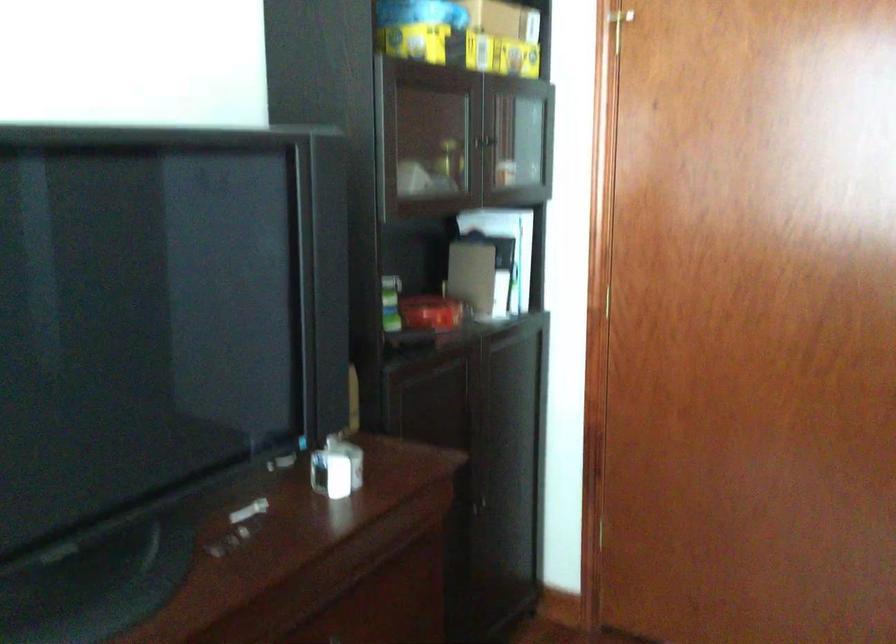
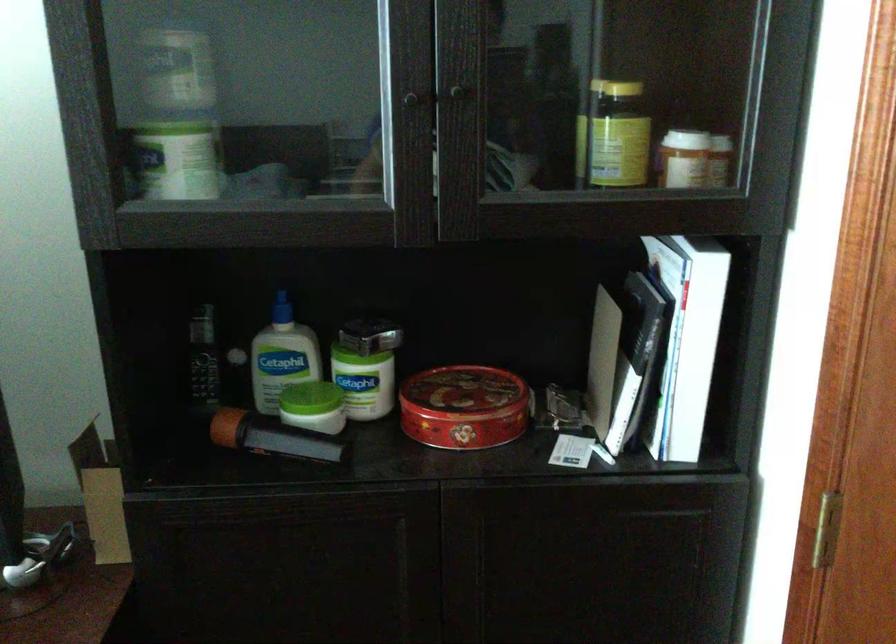
The point at [527,269] is marked in the first image. Where is the corresponding point in the second image?

(728, 373)